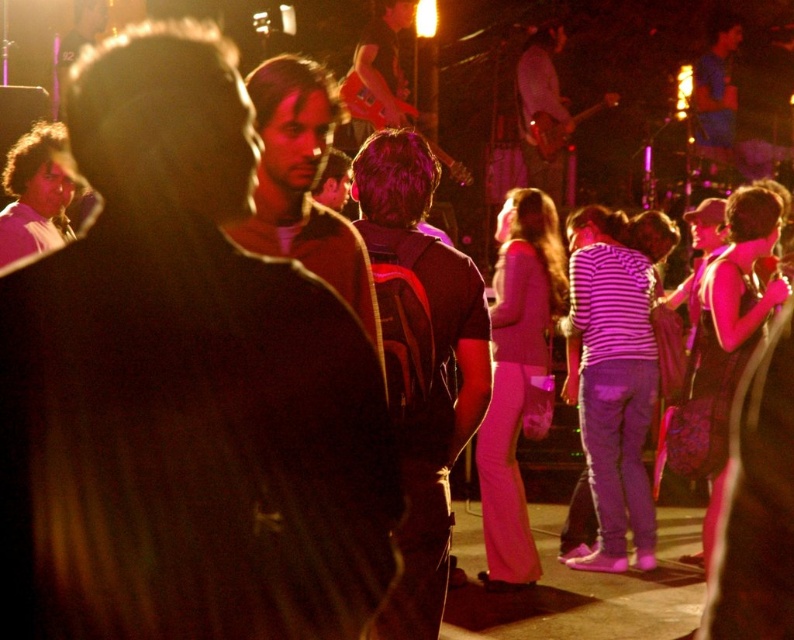
Question: Which object is positioned farthest from the dark brown backpack at center?

Choices:
 (A) dark brown hair at center
 (B) matte black shirt at center

Answer: (B)

Question: Is matte black shirt at center thinner than dark brown hair at center?

Choices:
 (A) yes
 (B) no

Answer: (B)

Question: Considering the real-world distances, which object is farthest from the dark brown backpack at center?

Choices:
 (A) matte black shirt at center
 (B) dark brown hair at center

Answer: (A)

Question: Based on their relative distances, which object is farther from the dark brown hair at center?

Choices:
 (A) matte black shirt at center
 (B) dark brown backpack at center

Answer: (A)

Question: From the image, what is the correct spatial relationship of dark brown backpack at center in relation to dark brown hair at center?

Choices:
 (A) below
 (B) above

Answer: (A)

Question: Where is dark brown backpack at center located in relation to dark brown hair at center in the image?

Choices:
 (A) below
 (B) above

Answer: (A)